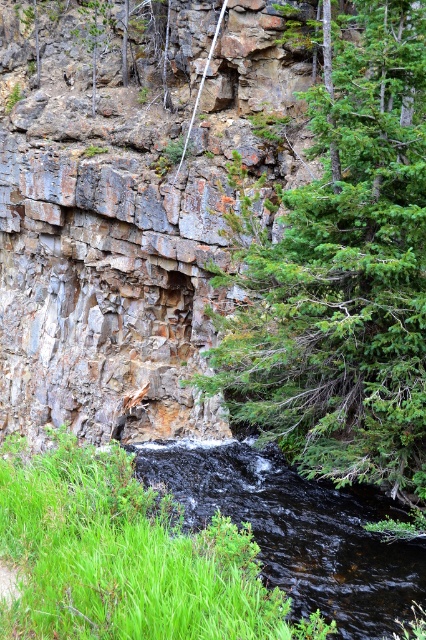
Who is positioned more to the right, green textured tree at center or black glossy stream at lower left?

Positioned to the right is green textured tree at center.

Is point (386, 44) positioned behind point (173, 464)?

No, (386, 44) is in front of (173, 464).

Locate an element on the screen. green textured tree at center is located at coordinates (342, 276).